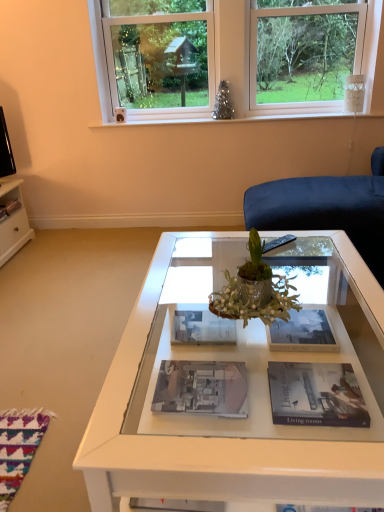
Question: Should I look upward or downward to see matte black magazine at left, which ranks as the 5th magazine in front-to-back order?

Choices:
 (A) up
 (B) down

Answer: (A)

Question: Is white glossy magazine at center, marked as the 3th magazine in a right-to-left arrangement, turned away from matte black magazine at left, acting as the fifth magazine starting from the right?

Choices:
 (A) yes
 (B) no

Answer: (B)

Question: Is white glossy magazine at center, which is counted as the third magazine, starting from the bottom, bigger than matte black magazine at left, which ranks as the 5th magazine in front-to-back order?

Choices:
 (A) no
 (B) yes

Answer: (B)

Question: From the image's perspective, does white glossy magazine at center, marked as the 3th magazine in a right-to-left arrangement, appear lower than matte black magazine at left, the 1th magazine positioned from the left?

Choices:
 (A) yes
 (B) no

Answer: (A)

Question: Can you confirm if white glossy magazine at center, the 4th magazine when ordered from front to back, is smaller than matte black magazine at left, the 5th magazine when ordered from bottom to top?

Choices:
 (A) yes
 (B) no

Answer: (B)

Question: Does white glossy magazine at center, the second magazine positioned from the back, appear on the right side of matte black magazine at left, the 1th magazine positioned from the left?

Choices:
 (A) no
 (B) yes

Answer: (B)

Question: From a real-world perspective, does white glossy magazine at center, the 4th magazine when ordered from front to back, sit lower than matte black magazine at left, the 1th magazine positioned from the left?

Choices:
 (A) yes
 (B) no

Answer: (A)

Question: Considering the relative positions of matte paper magazine at center, which is the 5th magazine from left to right, and matte paper magazine at center, which ranks as the first magazine in front-to-back order, in the image provided, is matte paper magazine at center, which is the 5th magazine from left to right, in front of matte paper magazine at center, which ranks as the first magazine in front-to-back order,?

Choices:
 (A) yes
 (B) no

Answer: (B)

Question: From the image's perspective, is matte paper magazine at center, acting as the 4th magazine starting from the bottom, under matte paper magazine at center, which ranks as the first magazine in front-to-back order?

Choices:
 (A) no
 (B) yes

Answer: (A)

Question: Can you confirm if matte paper magazine at center, the third magazine when ordered from back to front, is wider than matte paper magazine at center, acting as the fifth magazine starting from the top?

Choices:
 (A) yes
 (B) no

Answer: (B)

Question: Is matte paper magazine at center, the third magazine when ordered from back to front, facing towards matte paper magazine at center, which ranks as the first magazine in front-to-back order?

Choices:
 (A) yes
 (B) no

Answer: (B)

Question: Is matte paper magazine at center, acting as the 4th magazine starting from the bottom, further to the viewer compared to matte paper magazine at center, the 4th magazine viewed from the left?

Choices:
 (A) no
 (B) yes

Answer: (B)

Question: Is matte paper magazine at center, which ranks as the 1th magazine in right-to-left order, turned away from matte paper magazine at center, acting as the 5th magazine starting from the back?

Choices:
 (A) yes
 (B) no

Answer: (B)

Question: From the image's perspective, is white plastic window at upper center under matte paper magazine at center, the 2th magazine positioned from the top?

Choices:
 (A) no
 (B) yes

Answer: (A)